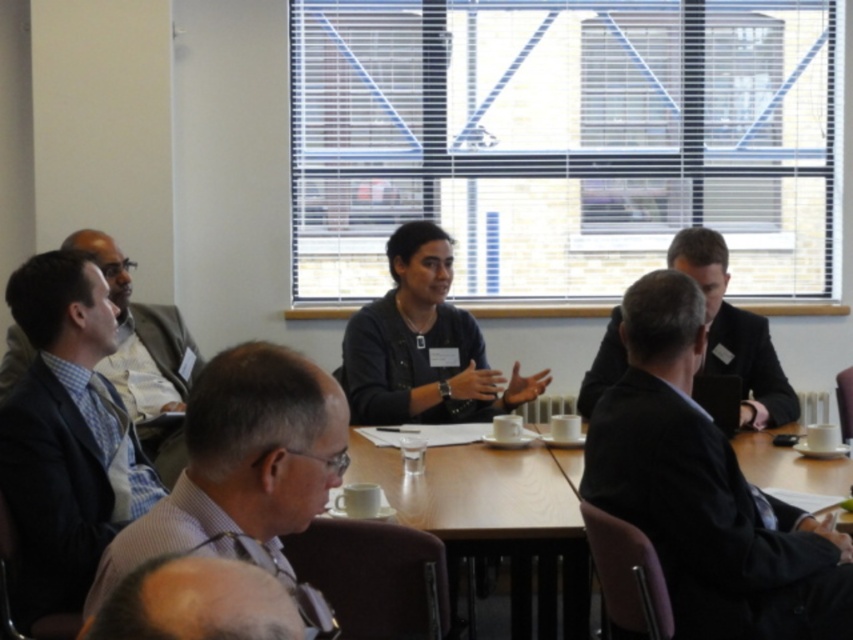
Identify the location of gray textured shirt at lower left. The width and height of the screenshot is (853, 640). (242, 465).

Between point (287, 500) and point (706, 307), which one is positioned behind?

The point (706, 307) is behind.

Who is more forward, [264,419] or [712,288]?

Point [264,419] is in front.

At what (x,y) coordinates should I click in order to perform the action: click on gray textured shirt at lower left. Please return your answer as a coordinate pair (x, y). The height and width of the screenshot is (640, 853). Looking at the image, I should click on (242, 465).

Which is below, wooden table at center or black suit at center?

Positioned lower is wooden table at center.

Which is above, wooden table at center or black suit at center?

black suit at center

Is point (485, 458) positioned before point (750, 419)?

Yes, it is in front of point (750, 419).

Locate an element on the screen. The height and width of the screenshot is (640, 853). wooden table at center is located at coordinates (497, 522).

Which is above, dark suit at center or dark blue suit at left?

Positioned higher is dark blue suit at left.

Who is more forward, (815, 522) or (28, 500)?

Positioned in front is point (815, 522).

The width and height of the screenshot is (853, 640). What do you see at coordinates (705, 490) in the screenshot?
I see `dark suit at center` at bounding box center [705, 490].

Where is `dark suit at center`? dark suit at center is located at coordinates (705, 490).